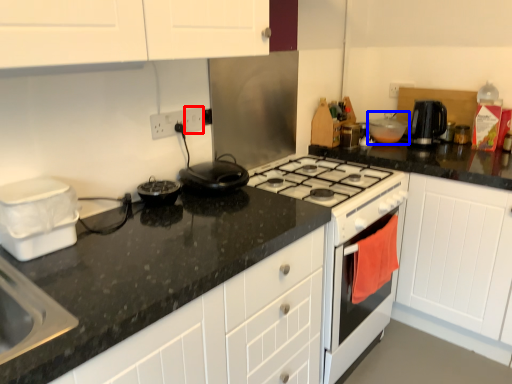
Question: Which object is closer to the camera taking this photo, electric outlet (highlighted by a red box) or kitchen appliance (highlighted by a blue box)?

Choices:
 (A) electric outlet
 (B) kitchen appliance

Answer: (A)